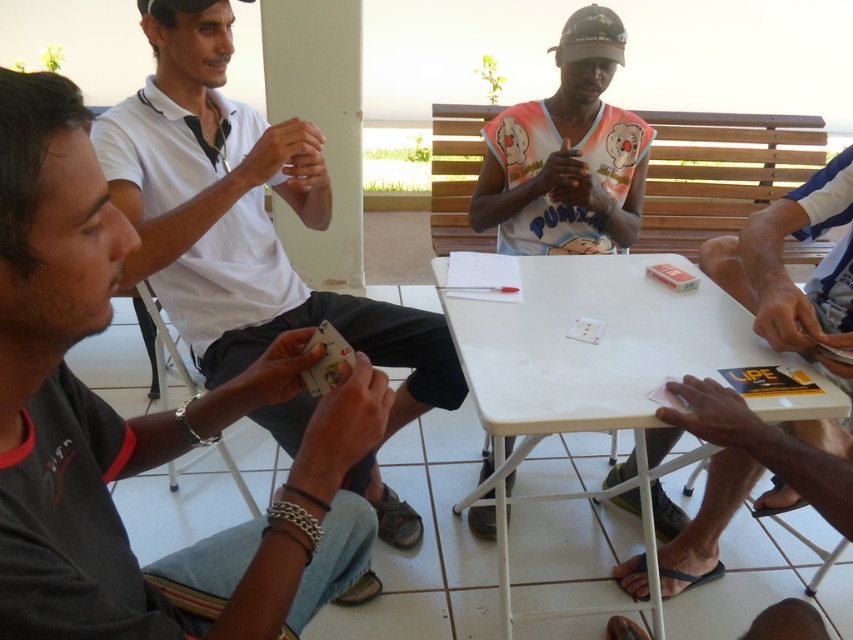
Question: Which of the following is the farthest from the observer?

Choices:
 (A) white sleeveless shirt at center
 (B) pink matte card at lower right
 (C) white matte shirt at left
 (D) white plastic table at center

Answer: (A)

Question: Is white matte shirt at left thinner than pink matte card at lower right?

Choices:
 (A) no
 (B) yes

Answer: (A)

Question: Which of the following is the farthest from the observer?

Choices:
 (A) (200, 305)
 (B) (618, 424)
 (C) (726, 477)
 (D) (491, 136)

Answer: (D)

Question: Does white matte shirt at left appear on the right side of pink matte card at lower right?

Choices:
 (A) yes
 (B) no

Answer: (B)

Question: Which of these objects is positioned farthest from the white sleeveless shirt at center?

Choices:
 (A) white plastic table at center
 (B) pink matte card at lower right
 (C) white matte shirt at left

Answer: (C)

Question: Can you confirm if white plastic table at center is thinner than pink matte card at lower right?

Choices:
 (A) yes
 (B) no

Answer: (B)